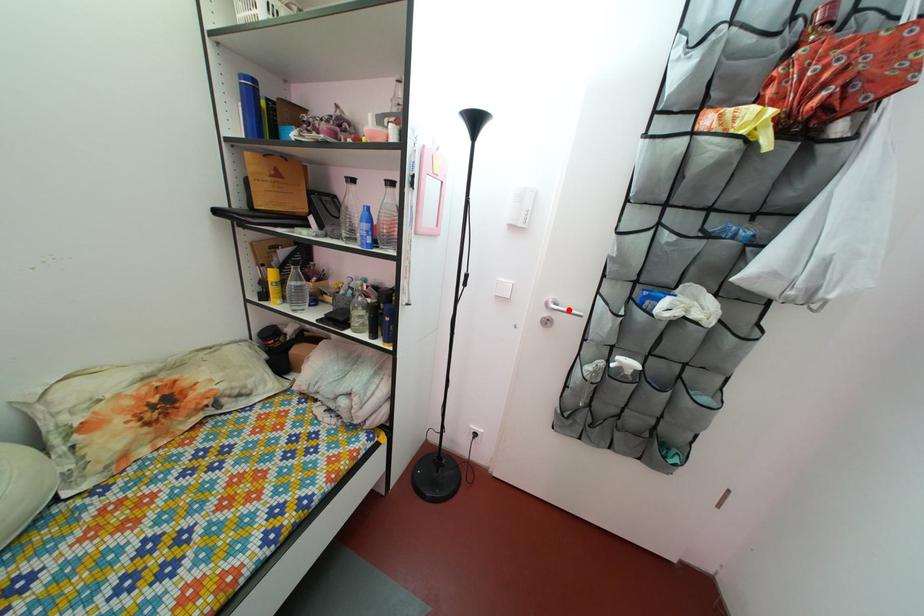
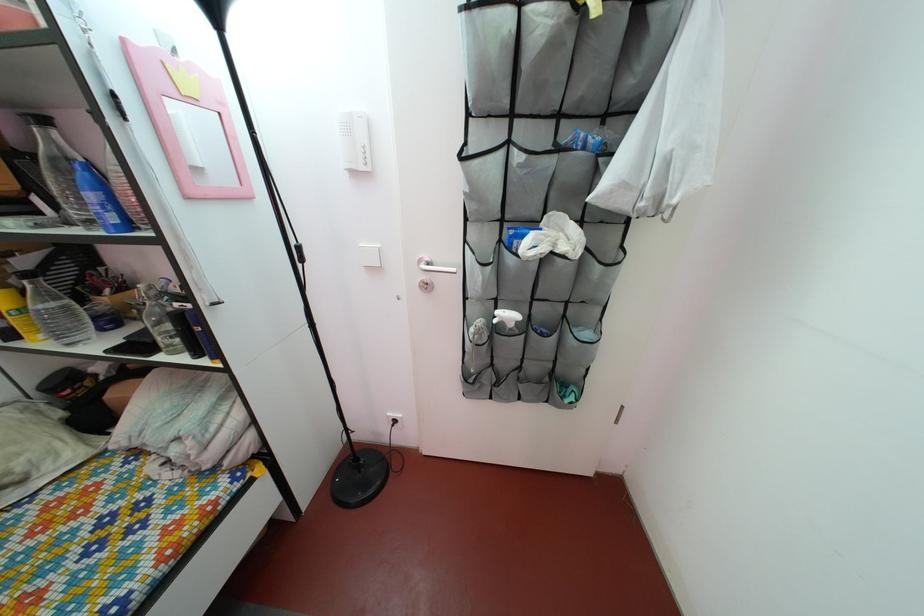
In the second image, find the point that corresponds to the highlighted location in the first image.

(443, 268)